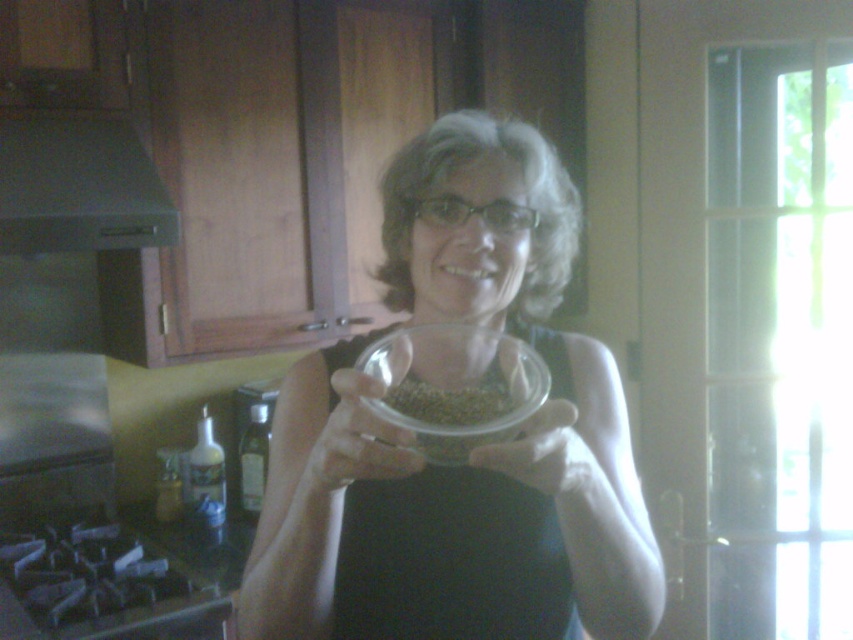
You are standing in the kitchen and want to reach the point at coordinates (497,636). If your arm can extend 30 inches, can you reach that point without moving?

The point at coordinates (497,636) is 34.75 inches away from the viewer. Since your arm can only extend 30 inches, you cannot reach that point without moving.

You are a delivery robot entering the kitchen and need to place a package between the two points, point (271, 468) and point (555, 419). Which point should you move towards first to ensure the package is placed closer to the viewer?

You should move towards point (271, 468) first because it is closer to the viewer compared to point (555, 419), ensuring the package is placed nearer to your position.

You are a chef preparing a dish and need to ensure that the clear glass bowl at center can hold the white matte hand at center. Based on the scene, will the bowl be able to accommodate the hand without any issues?

The clear glass bowl at center is taller than the white matte hand at center, so the bowl can accommodate the hand vertically. However, the question of whether it can hold the hand isn